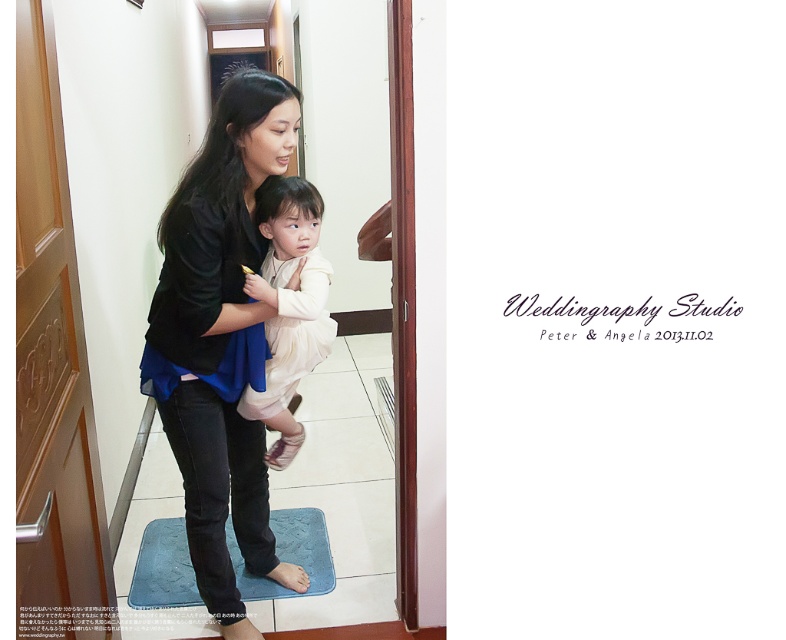
You are standing in the hallway and want to move from the point at coordinates point (208,220) to the point at coordinates point (184,605). Which direction should you face to walk towards the second point?

You should face towards the right direction because point (208,220) is in front of point (184,605), so moving towards the right would lead you towards the second point.

You need to place both the black matte jacket at center and the blue textured mat at lower center into a storage box. The box can only hold one item. Which item would you choose based on their sizes?

The black matte jacket at center is bigger than the blue textured mat at lower center, so you should choose the blue textured mat at lower center to fit into the storage box since it is smaller.

You are a delivery person who needs to place a package on the blue textured mat at lower center. However, there is a black matte jacket at center in the way. Can you move the jacket to access the mat?

The black matte jacket at center is closer to the viewer than the blue textured mat at lower center, so you can move the jacket to access the mat.